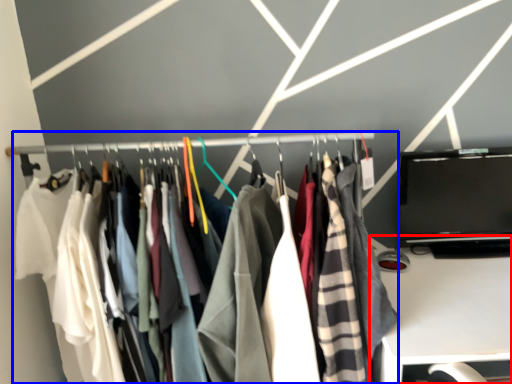
Question: Among these objects, which one is farthest to the camera, furniture (highlighted by a red box) or closet (highlighted by a blue box)?

Choices:
 (A) furniture
 (B) closet

Answer: (B)